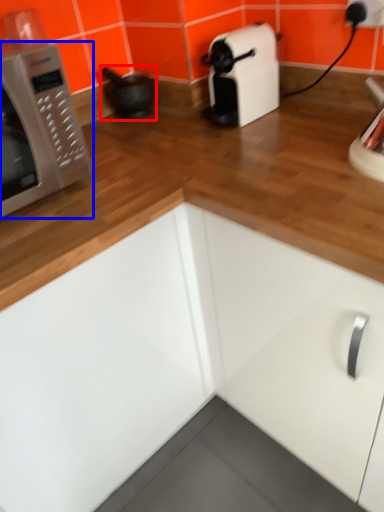
Question: Which object appears farthest to the camera in this image, appliance (highlighted by a red box) or microwave oven (highlighted by a blue box)?

Choices:
 (A) appliance
 (B) microwave oven

Answer: (A)